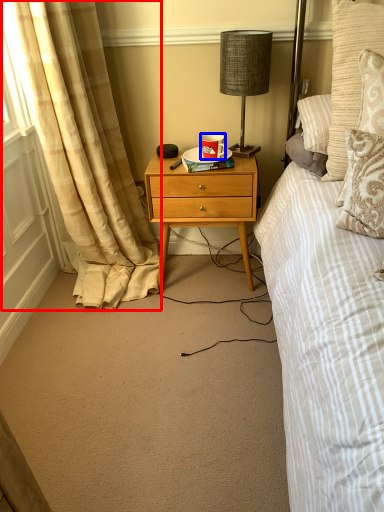
Question: Which point is further to the camera, curtain (highlighted by a red box) or coffee cup (highlighted by a blue box)?

Choices:
 (A) curtain
 (B) coffee cup

Answer: (B)